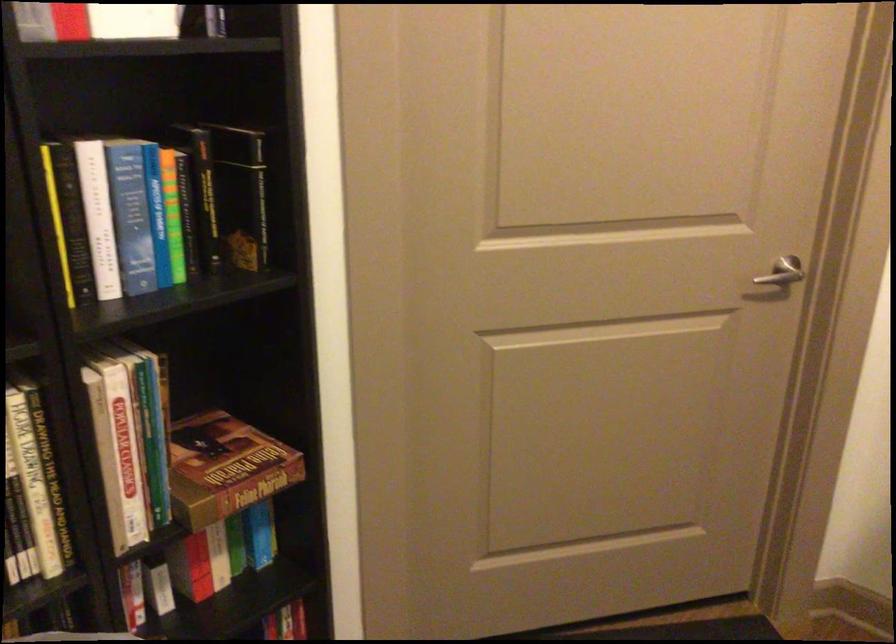
The location [171,214] corresponds to which object?

It corresponds to the green spine book in the image.